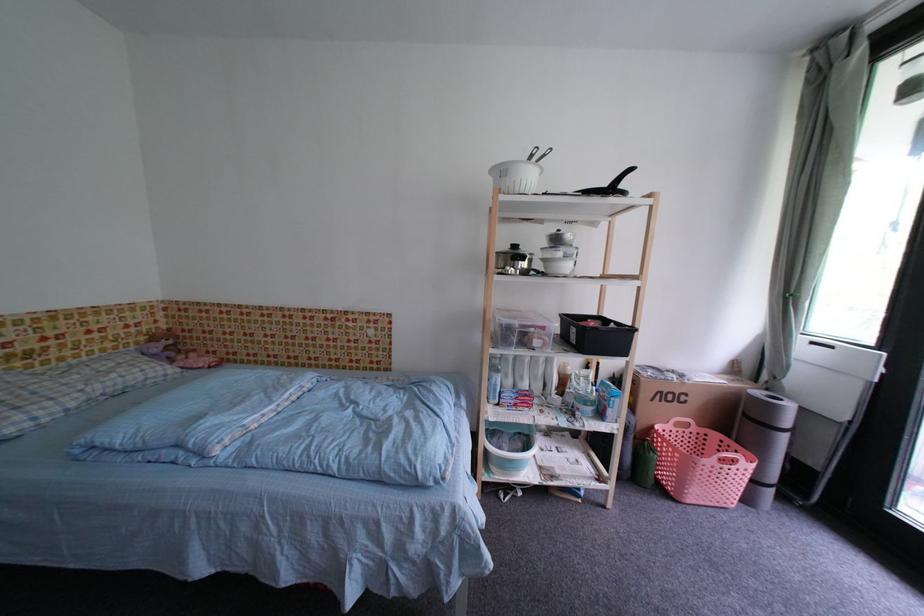
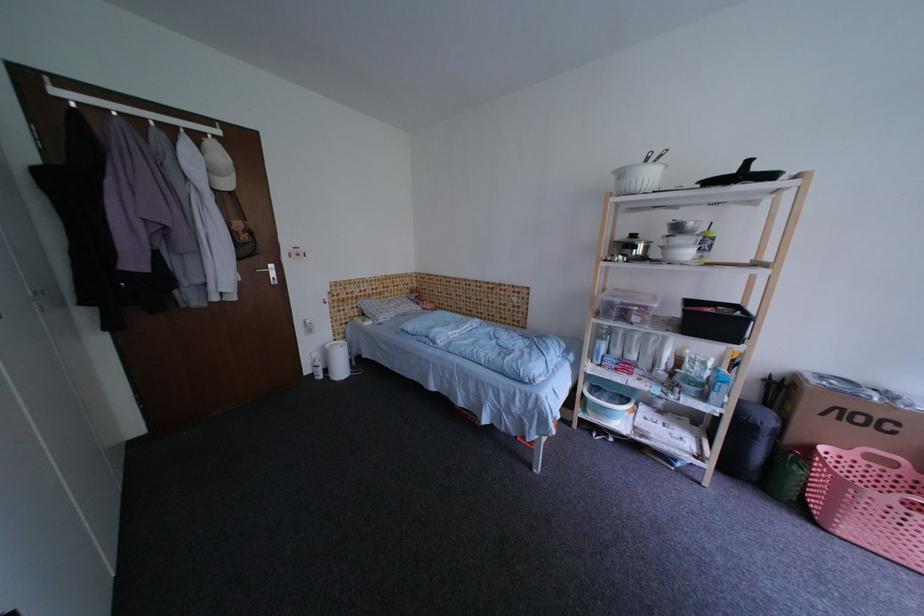
In the second image, find the point that corresponds to point (600, 326) in the first image.

(716, 313)